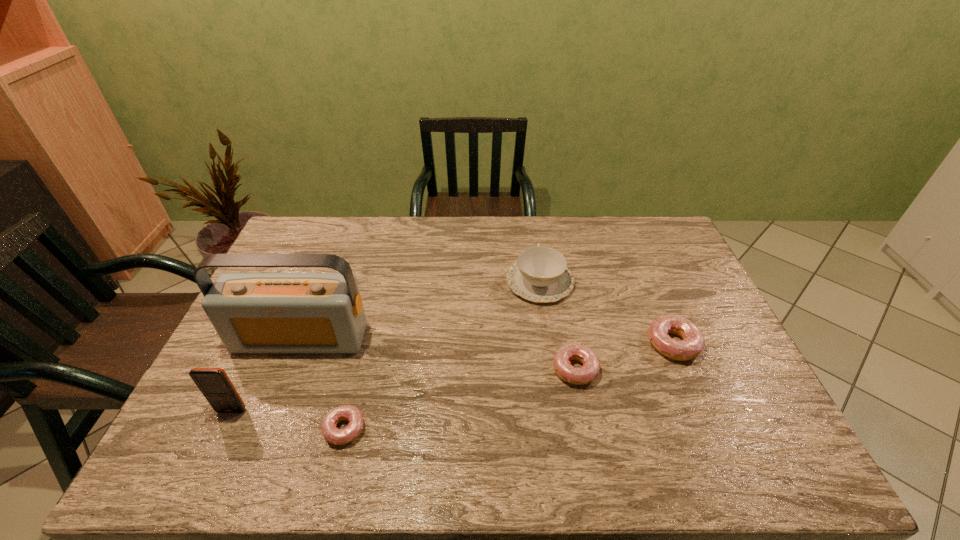
Point out which doughnut is positioned as the nearest to the tallest doughnut. Please provide its 2D coordinates. Your answer should be formatted as a tuple, i.e. [(x, y)], where the tuple contains the x and y coordinates of a point satisfying the conditions above.

[(588, 372)]

Image resolution: width=960 pixels, height=540 pixels. I want to click on the closest doughnut to the fourth shortest object, so click(x=588, y=372).

Identify the location of free location that satisfies the following two spatial constraints: 1. on the front-facing side of the shortest doughnut; 2. on the right side of the tallest object. This screenshot has height=540, width=960. (266, 429).

Identify the location of vacant point that satisfies the following two spatial constraints: 1. on the front-facing side of the tallest doughnut; 2. on the left side of the tallest object. The height and width of the screenshot is (540, 960). (299, 344).

The height and width of the screenshot is (540, 960). Identify the location of vacant point that satisfies the following two spatial constraints: 1. on the front-facing side of the fifth tallest object; 2. on the right side of the tallest object. (289, 369).